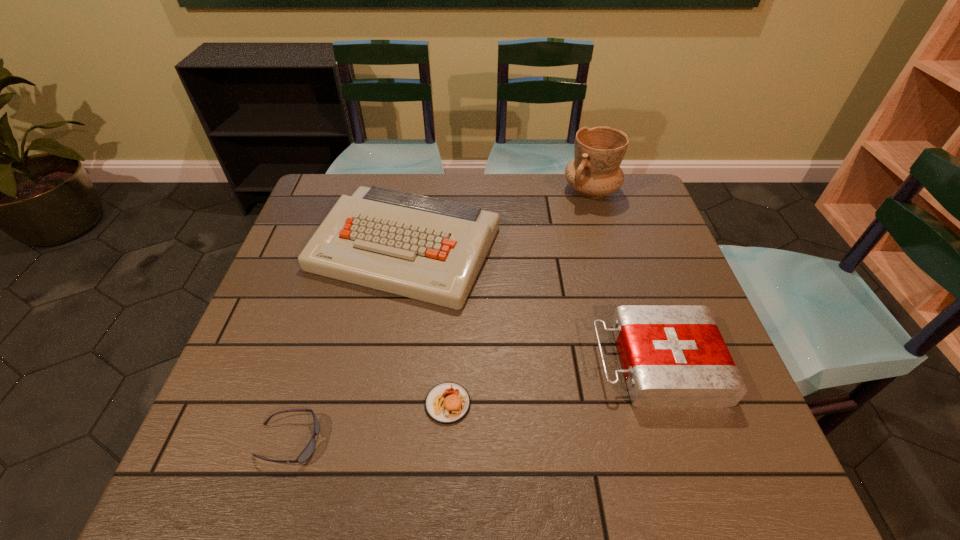
You are a GUI agent. You are given a task and a screenshot of the screen. Output one action in this format:
    pyautogui.click(x=<x>, y=<y>)
    Task: Click on the blank area in the image that satisfies the following two spatial constraints: 1. on the back side of the pottery; 2. on the right side of the computer keyboard
    Image resolution: width=960 pixels, height=540 pixels.
    Given the screenshot: What is the action you would take?
    pyautogui.click(x=416, y=191)